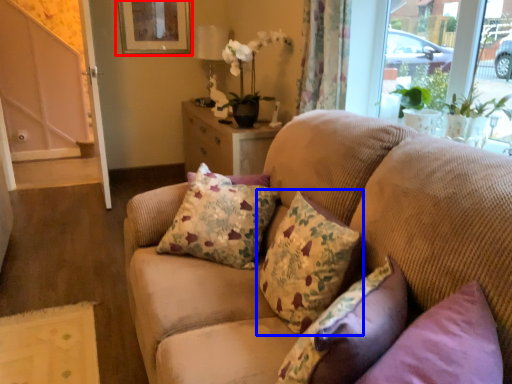
Question: Which point is further to the camera, picture frame (highlighted by a red box) or pillow (highlighted by a blue box)?

Choices:
 (A) picture frame
 (B) pillow

Answer: (A)